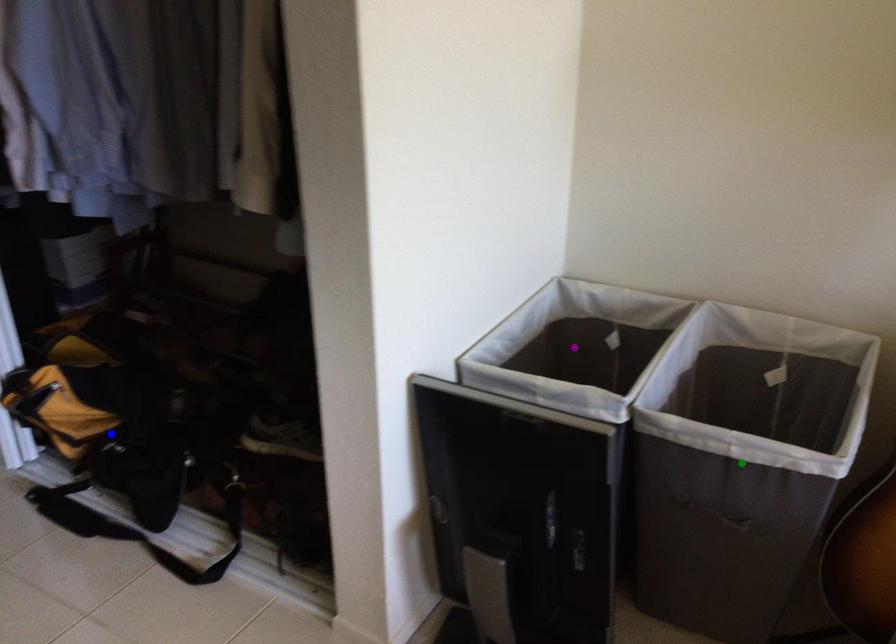
Order these from farthest to nearest:
green point
blue point
purple point

blue point, purple point, green point